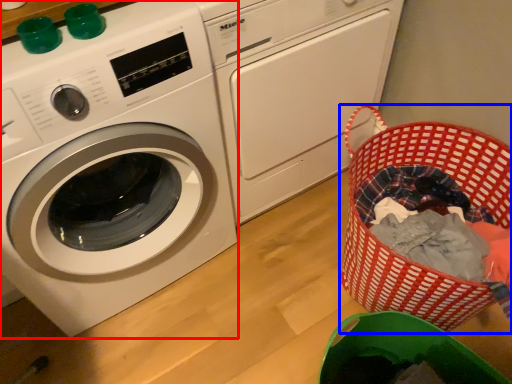
Question: Among these objects, which one is farthest to the camera, washing machine (highlighted by a red box) or basket (highlighted by a blue box)?

Choices:
 (A) washing machine
 (B) basket

Answer: (B)